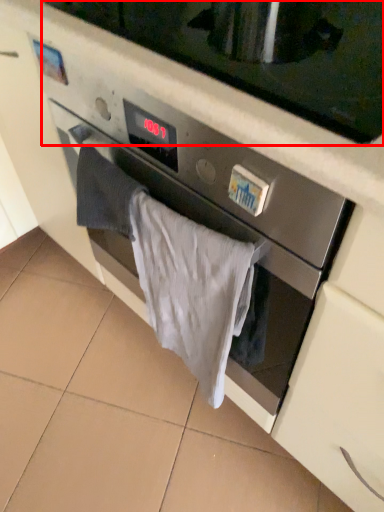
Question: Considering the relative positions of microwave oven (annotated by the red box) and bath towel in the image provided, where is microwave oven (annotated by the red box) located with respect to the staircase?

Choices:
 (A) right
 (B) left

Answer: (A)